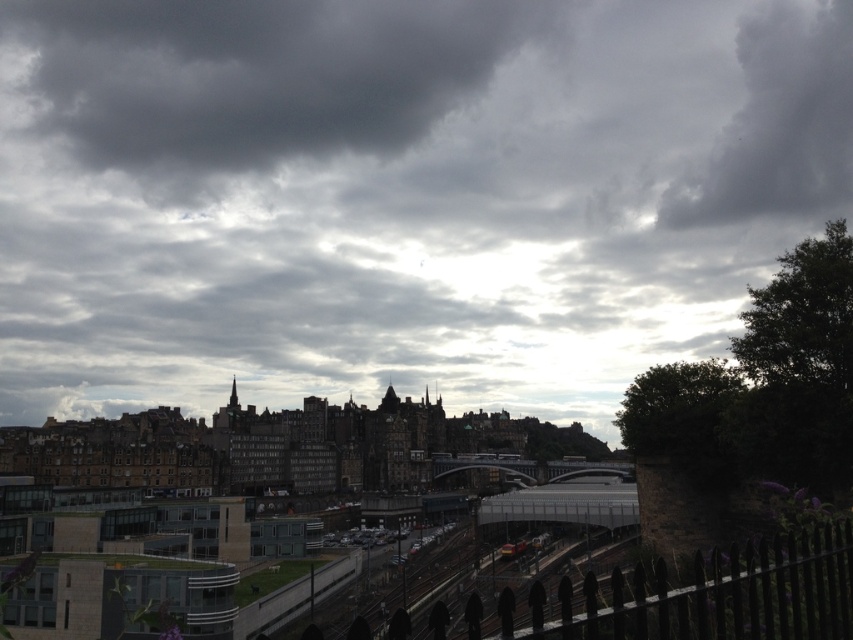
Question: Which of the following is the closest to the observer?

Choices:
 (A) dark gray cloud at upper right
 (B) dark gray cloud at upper center

Answer: (B)

Question: Which of these objects is positioned farthest from the dark gray cloud at upper center?

Choices:
 (A) black wrought iron fence at lower right
 (B) dark gray cloud at upper right

Answer: (A)

Question: Observing the image, what is the correct spatial positioning of dark gray cloud at upper right in reference to black wrought iron fence at lower right?

Choices:
 (A) below
 (B) above

Answer: (B)

Question: Can you confirm if dark gray cloud at upper center is positioned to the left of dark gray cloud at upper right?

Choices:
 (A) no
 (B) yes

Answer: (B)

Question: Does dark gray cloud at upper center appear on the left side of black wrought iron fence at lower right?

Choices:
 (A) no
 (B) yes

Answer: (B)

Question: Which of the following is the closest to the observer?

Choices:
 (A) black wrought iron fence at lower right
 (B) dark gray cloud at upper center
 (C) dark gray cloud at upper right

Answer: (A)